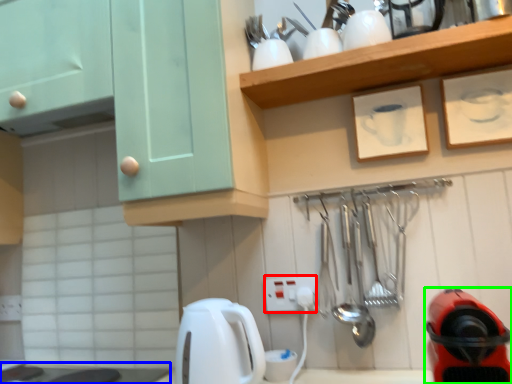
Question: Which object is the closest to the electric outlet (highlighted by a red box)? Choose among these: counter top (highlighted by a blue box) or home appliance (highlighted by a green box).

Choices:
 (A) counter top
 (B) home appliance

Answer: (B)